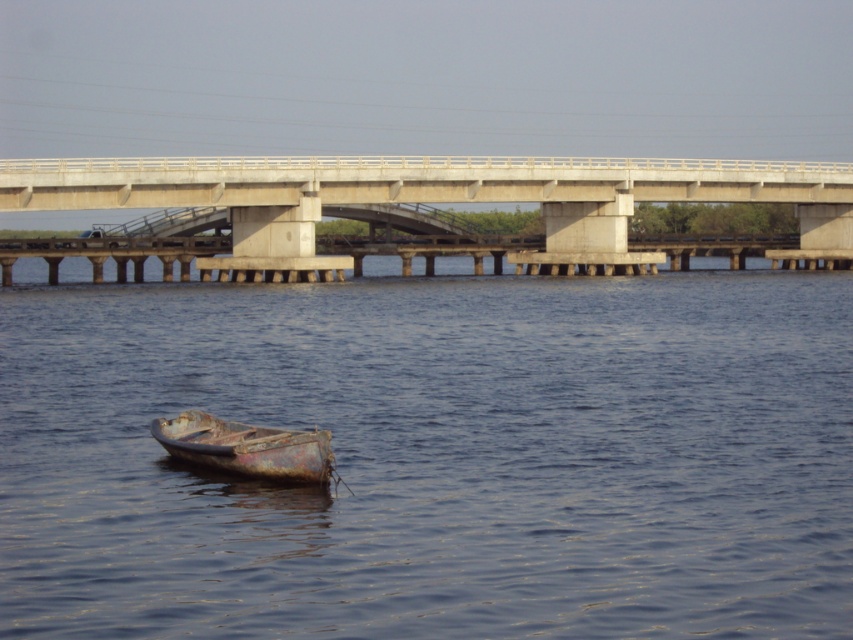
Is blue metallic boat at lower left smaller than concrete bridge at center?

Yes, blue metallic boat at lower left is smaller than concrete bridge at center.

Who is positioned more to the right, blue metallic boat at lower left or concrete bridge at center?

From the viewer's perspective, concrete bridge at center appears more on the right side.

Where is `blue metallic boat at lower left`? This screenshot has width=853, height=640. blue metallic boat at lower left is located at coordinates [434, 458].

Is concrete bridge at center taller than rusty metal boat at lower center?

Indeed, concrete bridge at center has a greater height compared to rusty metal boat at lower center.

Which is behind, point (628, 172) or point (198, 436)?

Positioned behind is point (628, 172).

At what (x,y) coordinates should I click in order to perform the action: click on concrete bridge at center. Please return your answer as a coordinate pair (x, y). The height and width of the screenshot is (640, 853). Looking at the image, I should click on (432, 193).

Who is more forward, (770,346) or (320,476)?

Point (320,476) is in front.

Between point (306, 609) and point (328, 435), which one is positioned behind?

The point (328, 435) is behind.

Describe the element at coordinates (434, 458) in the screenshot. I see `blue metallic boat at lower left` at that location.

I want to click on blue metallic boat at lower left, so [434, 458].